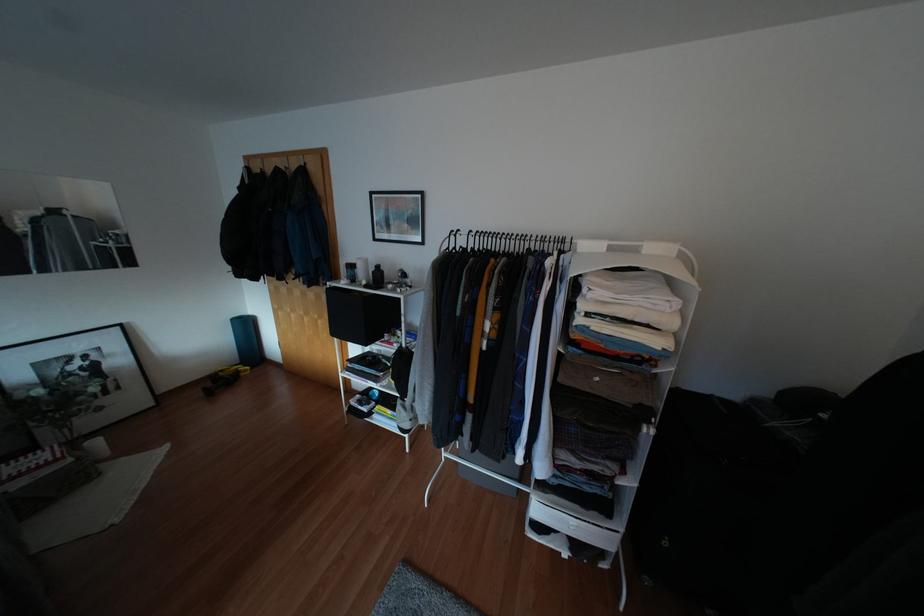
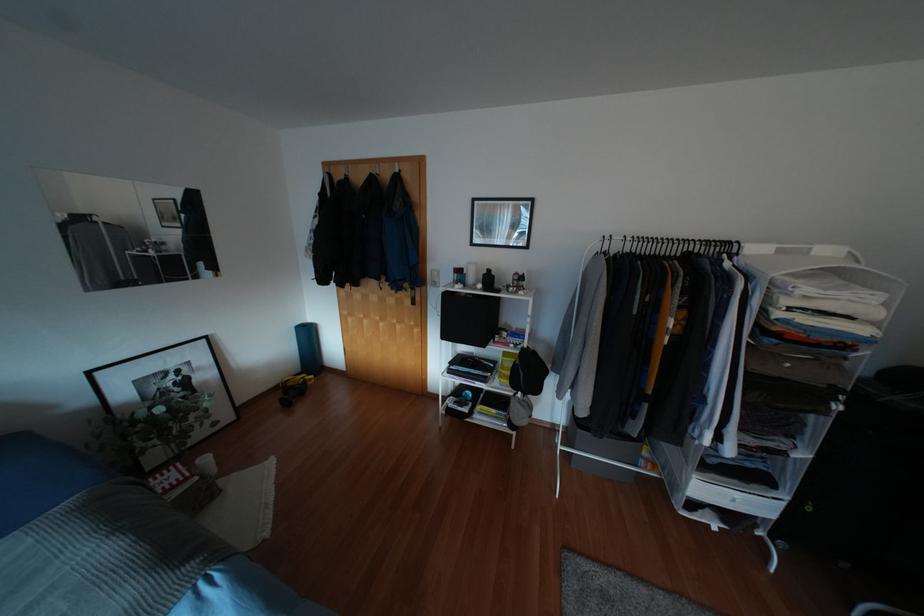
Question: How did the camera likely rotate?

Choices:
 (A) Left
 (B) Right
 (C) Up
 (D) Down

Answer: (B)